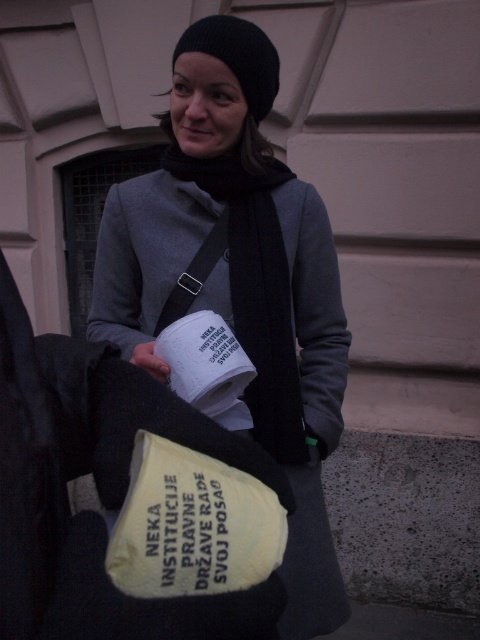
Question: Does matte gray sweater at center have a smaller size compared to black knit hat at upper center?

Choices:
 (A) no
 (B) yes

Answer: (A)

Question: Which point is farther to the camera?

Choices:
 (A) white matte paper cup at center
 (B) matte gray sweater at center
 (C) black knit hat at upper center

Answer: (C)

Question: Which point is farther to the camera?

Choices:
 (A) (231, 58)
 (B) (252, 369)
 (C) (252, 77)

Answer: (C)

Question: Observing the image, what is the correct spatial positioning of matte gray sweater at center in reference to white matte paper cup at center?

Choices:
 (A) above
 (B) below

Answer: (A)

Question: Does matte gray sweater at center have a lesser width compared to white matte paper cup at center?

Choices:
 (A) no
 (B) yes

Answer: (A)

Question: Estimate the real-world distances between objects in this image. Which object is closer to the white matte paper cup at center?

Choices:
 (A) matte gray sweater at center
 (B) black knit hat at upper center

Answer: (A)